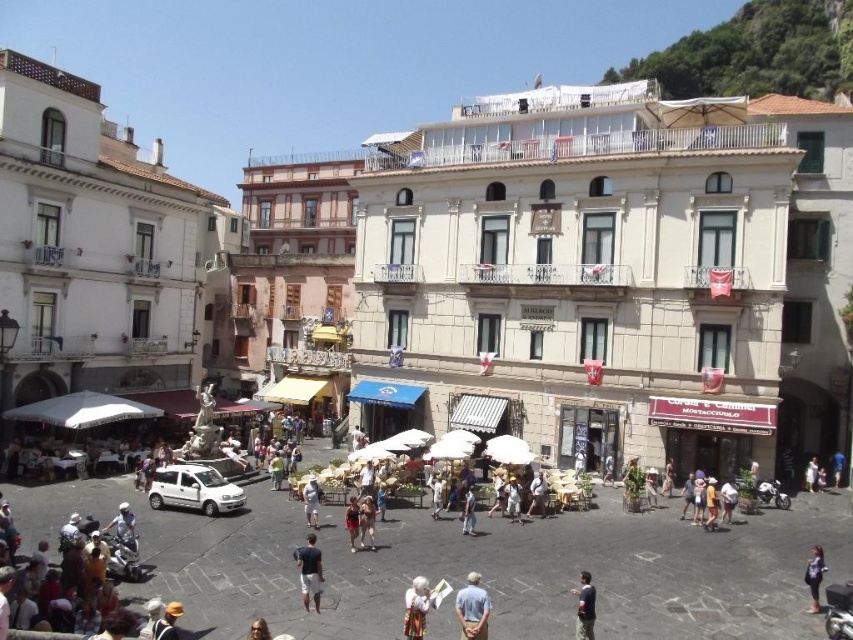
Image resolution: width=853 pixels, height=640 pixels. In order to click on dark blue fabric shirt at center in this screenshot , I will do (x=309, y=572).

Does white matte van at lower left lie behind light brown leather shorts at center?

Yes, it is.

Which is more to the left, white matte van at lower left or light brown leather shorts at center?

white matte van at lower left

Describe the element at coordinates (194, 490) in the screenshot. I see `white matte van at lower left` at that location.

Locate an element on the screen. The width and height of the screenshot is (853, 640). white matte van at lower left is located at coordinates (194, 490).

Is white fabric bag at lower center bigger than matte black dress at lower right?

Correct, white fabric bag at lower center is larger in size than matte black dress at lower right.

Does white fabric bag at lower center have a greater width compared to matte black dress at lower right?

Correct, the width of white fabric bag at lower center exceeds that of matte black dress at lower right.

Measure the distance between point (416, 620) and camera.

Point (416, 620) and camera are 31.33 meters apart from each other.

You are a GUI agent. You are given a task and a screenshot of the screen. Output one action in this format:
    pyautogui.click(x=<x>, y=<y>)
    Task: Click on the white fabric bag at lower center
    This screenshot has height=640, width=853.
    Given the screenshot: What is the action you would take?
    pyautogui.click(x=415, y=609)